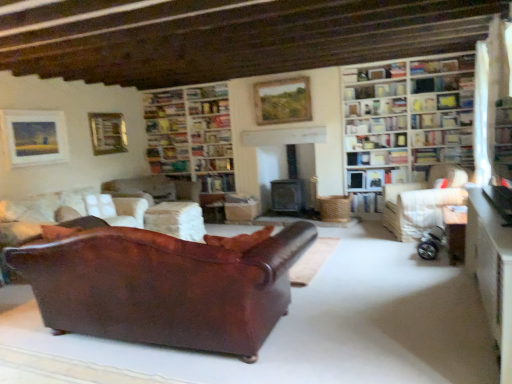
Question: Considering the positions of white wooden bookcase at upper right, which is the 2th bookcase in back-to-front order, and hardcover book at center, positioned as the 5th book in right-to-left order, in the image, is white wooden bookcase at upper right, which is the 2th bookcase in back-to-front order, wider or thinner than hardcover book at center, positioned as the 5th book in right-to-left order,?

Choices:
 (A) thin
 (B) wide

Answer: (B)

Question: In terms of size, does white wooden bookcase at upper right, which is the 2th bookcase in left-to-right order, appear bigger or smaller than hardcover book at center, positioned as the 5th book in right-to-left order?

Choices:
 (A) big
 (B) small

Answer: (A)

Question: Based on their relative distances, which object is nearer to the wooden table at lower right, the second table in the left-to-right sequence?

Choices:
 (A) wooden bookshelf at center, acting as the second shelf starting from the bottom
 (B) hardcover book at center, the fourth book from the right
 (C) hardcover book at center, marked as the third book in a right-to-left arrangement
 (D) leather couch at lower left, placed as the first studio couch when sorted from left to right
 (E) white fabric couch at right, which appears as the third studio couch when viewed from the left

Answer: (E)

Question: Which is nearer to the hardcover book at center, arranged as the fourth book when viewed from the top?

Choices:
 (A) hardcover book at upper right, the 5th book ordered from the bottom
 (B) hardcover book at center, the second book from the top
 (C) white fabric curtain at upper right
 (D) white wooden bookcase at upper right, the 1th bookcase viewed from the front
 (E) wooden bookshelf at upper right, which is the 2th shelf in top-to-bottom order

Answer: (B)